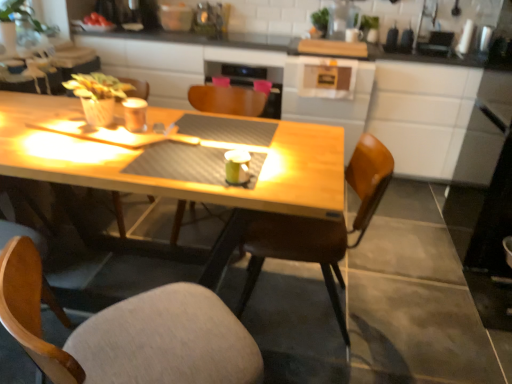
Question: Is wooden table at center positioned behind green matte mug at center, acting as the second coffee cup starting from the left?

Choices:
 (A) yes
 (B) no

Answer: (A)

Question: Is wooden table at center far from green matte mug at center, which appears as the first coffee cup when viewed from the right?

Choices:
 (A) no
 (B) yes

Answer: (B)

Question: Is wooden table at center taller than green matte mug at center, which is the second coffee cup from top to bottom?

Choices:
 (A) yes
 (B) no

Answer: (A)

Question: Would you say wooden table at center is outside green matte mug at center, which is the second coffee cup from top to bottom?

Choices:
 (A) no
 (B) yes

Answer: (B)

Question: Can you confirm if wooden table at center is wider than green matte mug at center, which appears as the first coffee cup when viewed from the right?

Choices:
 (A) no
 (B) yes

Answer: (B)

Question: Is green matte mug at center, acting as the second coffee cup starting from the left, completely or partially inside wooden table at center?

Choices:
 (A) yes
 (B) no

Answer: (B)

Question: From the image's perspective, is wooden chair at center, the first chair in the back-to-front sequence, on top of green matte mug at center, which is the first coffee cup in bottom-to-top order?

Choices:
 (A) yes
 (B) no

Answer: (A)

Question: From the image's perspective, would you say wooden chair at center, the first chair in the back-to-front sequence, is shown under green matte mug at center, which appears as the first coffee cup when viewed from the right?

Choices:
 (A) yes
 (B) no

Answer: (B)

Question: Is wooden chair at center, arranged as the third chair when viewed from the front, smaller than green matte mug at center, which is the second coffee cup from top to bottom?

Choices:
 (A) yes
 (B) no

Answer: (B)

Question: From a real-world perspective, is wooden chair at center, the first chair in the back-to-front sequence, on green matte mug at center, acting as the second coffee cup starting from the left?

Choices:
 (A) yes
 (B) no

Answer: (B)

Question: Does wooden chair at center, arranged as the third chair when viewed from the front, lie behind green matte mug at center, marked as the second coffee cup in a back-to-front arrangement?

Choices:
 (A) no
 (B) yes

Answer: (B)

Question: Considering the relative positions of wooden chair at center, arranged as the third chair when viewed from the front, and green matte mug at center, marked as the second coffee cup in a back-to-front arrangement, in the image provided, is wooden chair at center, arranged as the third chair when viewed from the front, to the right of green matte mug at center, marked as the second coffee cup in a back-to-front arrangement, from the viewer's perspective?

Choices:
 (A) no
 (B) yes

Answer: (A)

Question: Can you confirm if brown leather chair at center, positioned as the second chair in back-to-front order, is wider than wooden chair at center, the first chair in the back-to-front sequence?

Choices:
 (A) no
 (B) yes

Answer: (A)